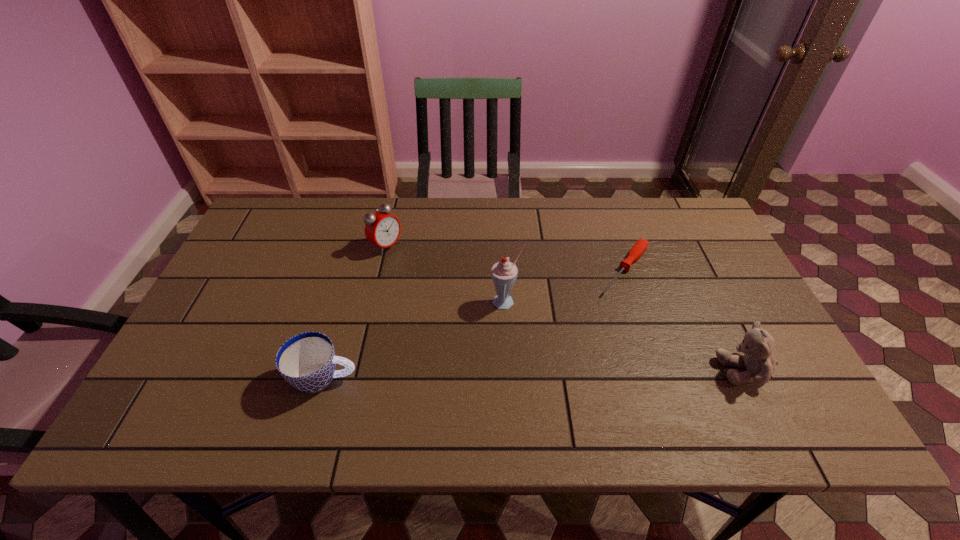
Identify which object is the second nearest to the third object from left to right. Please provide its 2D coordinates. Your answer should be formatted as a tuple, i.e. [(x, y)], where the tuple contains the x and y coordinates of a point satisfying the conditions above.

[(383, 229)]

Identify the location of object that stands as the closest to the alarm clock. The width and height of the screenshot is (960, 540). (504, 273).

Where is `vacant point that satisfies the following two spatial constraints: 1. on the front side of the fourth object from left to right; 2. on the right side of the alarm clock`? vacant point that satisfies the following two spatial constraints: 1. on the front side of the fourth object from left to right; 2. on the right side of the alarm clock is located at coordinates (381, 270).

Where is `free spot that satisfies the following two spatial constraints: 1. on the front side of the third object from right to left; 2. on the face of the teddy bear`? free spot that satisfies the following two spatial constraints: 1. on the front side of the third object from right to left; 2. on the face of the teddy bear is located at coordinates (510, 370).

You are a GUI agent. You are given a task and a screenshot of the screen. Output one action in this format:
    pyautogui.click(x=<x>, y=<y>)
    Task: Click on the free space that satisfies the following two spatial constraints: 1. on the back side of the fourth object from left to right; 2. on the right side of the milkshake
    
    Given the screenshot: What is the action you would take?
    pyautogui.click(x=505, y=270)

In order to click on free region that satisfies the following two spatial constraints: 1. on the front side of the alarm clock; 2. on the left side of the milkshake in this screenshot , I will do `click(373, 302)`.